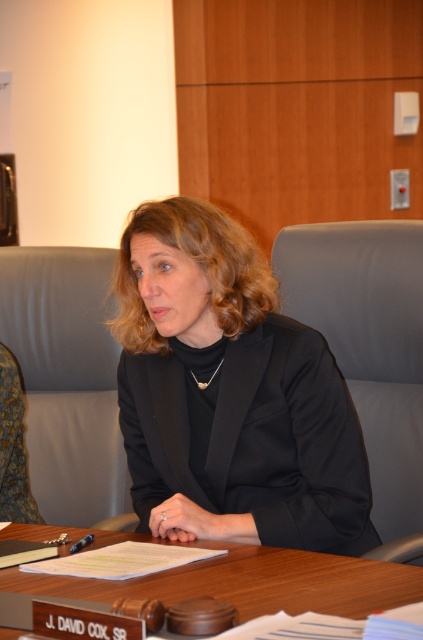
Is point (16, 580) behind point (91, 540)?

That is False.

Does wooden table at center have a larger size compared to blue plastic pen at center?

Correct, wooden table at center is larger in size than blue plastic pen at center.

Describe the element at coordinates (252, 582) in the screenshot. I see `wooden table at center` at that location.

At what (x,y) coordinates should I click in order to perform the action: click on wooden table at center. Please return your answer as a coordinate pair (x, y). The width and height of the screenshot is (423, 640). Looking at the image, I should click on (252, 582).

From the picture: Can you confirm if black matte blazer at center is positioned to the right of blue plastic pen at center?

Yes, black matte blazer at center is to the right of blue plastic pen at center.

Between black matte blazer at center and blue plastic pen at center, which one appears on the right side from the viewer's perspective?

Positioned to the right is black matte blazer at center.

Based on the photo, who is more distant from viewer, (233, 468) or (87, 538)?

Point (233, 468)

Locate an element on the screen. The height and width of the screenshot is (640, 423). black matte blazer at center is located at coordinates (230, 392).

Does black matte blazer at center appear on the right side of wooden table at center?

Indeed, black matte blazer at center is positioned on the right side of wooden table at center.

Is black matte blazer at center smaller than wooden table at center?

Incorrect, black matte blazer at center is not smaller in size than wooden table at center.

The height and width of the screenshot is (640, 423). What do you see at coordinates (230, 392) in the screenshot?
I see `black matte blazer at center` at bounding box center [230, 392].

Locate an element on the screen. black matte blazer at center is located at coordinates (230, 392).